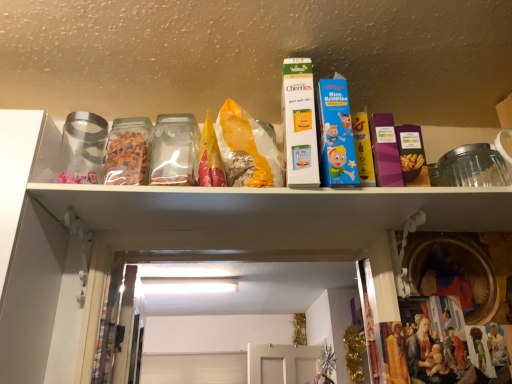
Question: Which direction should I rotate to look at blue cardboard rice krispies cereal box at center, the 1th product viewed from the right, — up or down?

Choices:
 (A) down
 (B) up

Answer: (B)

Question: Is transparent plastic container at center in front of blue cardboard rice krispies cereal box at center, the 1th product viewed from the right?

Choices:
 (A) yes
 (B) no

Answer: (B)

Question: Is transparent plastic container at center oriented away from blue cardboard rice krispies cereal box at center, the 1th product viewed from the right?

Choices:
 (A) no
 (B) yes

Answer: (A)

Question: Is transparent plastic container at center not within blue cardboard rice krispies cereal box at center, which is the second product in left-to-right order?

Choices:
 (A) yes
 (B) no

Answer: (A)

Question: Is transparent plastic container at center thinner than blue cardboard rice krispies cereal box at center, which is the second product in left-to-right order?

Choices:
 (A) yes
 (B) no

Answer: (B)

Question: From the image's perspective, is transparent plastic container at center under blue cardboard rice krispies cereal box at center, which is the second product in left-to-right order?

Choices:
 (A) no
 (B) yes

Answer: (B)

Question: Is transparent plastic container at center not near blue cardboard rice krispies cereal box at center, the 1th product viewed from the right?

Choices:
 (A) yes
 (B) no

Answer: (B)

Question: Are blue cardboard rice krispies cereal box at center, the 1th product viewed from the right, and transparent plastic container at center making contact?

Choices:
 (A) no
 (B) yes

Answer: (A)

Question: Does blue cardboard rice krispies cereal box at center, which is the second product in left-to-right order, have a larger size compared to transparent plastic container at center?

Choices:
 (A) no
 (B) yes

Answer: (A)

Question: Can you confirm if blue cardboard rice krispies cereal box at center, the 1th product viewed from the right, is shorter than transparent plastic container at center?

Choices:
 (A) no
 (B) yes

Answer: (A)

Question: Considering the relative sizes of blue cardboard rice krispies cereal box at center, the 1th product viewed from the right, and transparent plastic container at center in the image provided, is blue cardboard rice krispies cereal box at center, the 1th product viewed from the right, taller than transparent plastic container at center?

Choices:
 (A) no
 (B) yes

Answer: (B)

Question: Is there a large distance between blue cardboard rice krispies cereal box at center, which is the second product in left-to-right order, and transparent plastic container at center?

Choices:
 (A) no
 (B) yes

Answer: (A)

Question: From the image's perspective, is blue cardboard rice krispies cereal box at center, which is the second product in left-to-right order, under transparent plastic container at center?

Choices:
 (A) no
 (B) yes

Answer: (A)

Question: From the image's perspective, would you say white cardboard cheerios box at upper center, marked as the second product in a right-to-left arrangement, is shown under blue cardboard rice krispies cereal box at center, the 1th product viewed from the right?

Choices:
 (A) no
 (B) yes

Answer: (A)